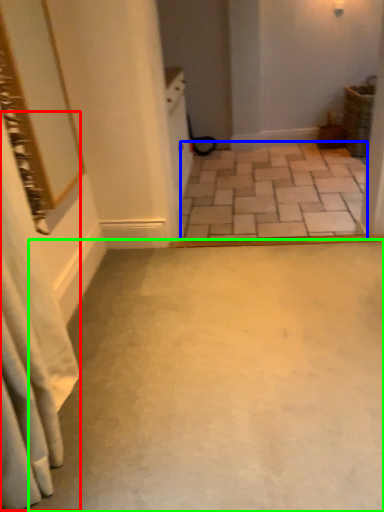
Question: Which is farther away from shower curtain (highlighted by a red box)? concrete (highlighted by a blue box) or concrete (highlighted by a green box)?

Choices:
 (A) concrete
 (B) concrete

Answer: (A)